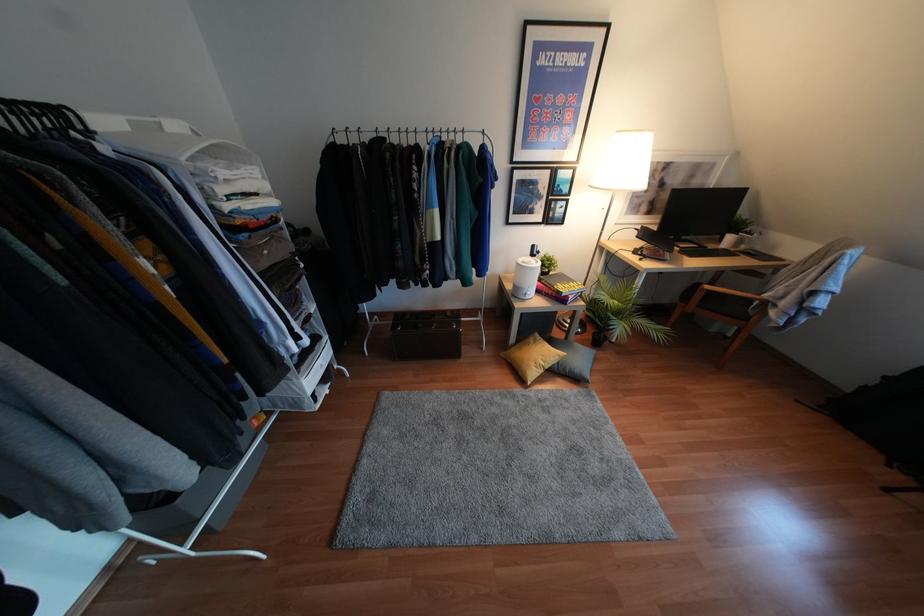
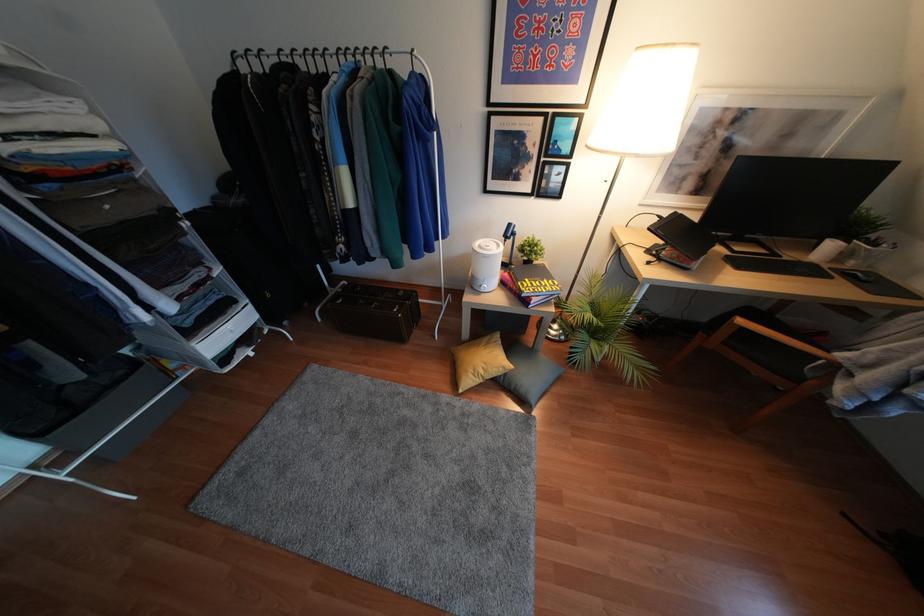
The point at (707,286) is marked in the first image. Where is the corresponding point in the second image?

(739, 321)